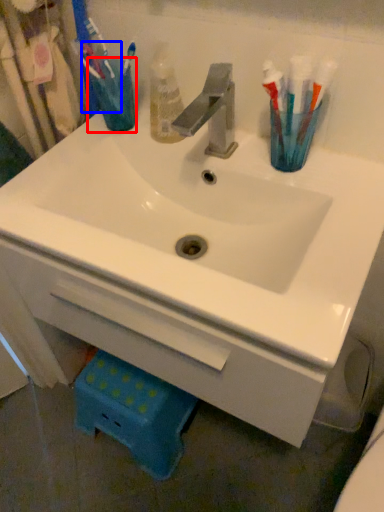
Question: Which of the following is the farthest to the observer, turquoise (highlighted by a red box) or toothbrush (highlighted by a blue box)?

Choices:
 (A) turquoise
 (B) toothbrush

Answer: (A)